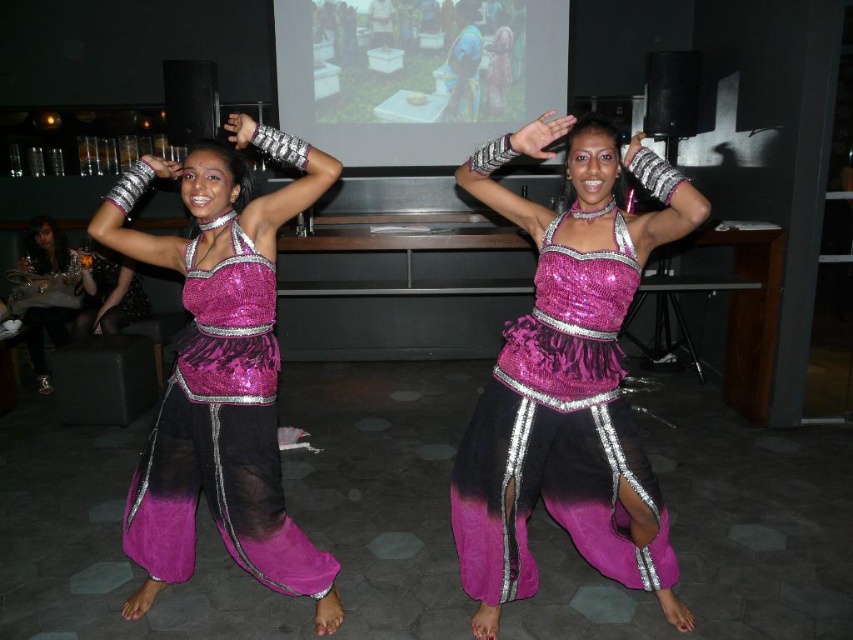
Is point (546, 317) positioned before point (207, 429)?

Yes.

Does shiny sequined dress at center have a greater width compared to fuchsia sequined dress at center?

In fact, shiny sequined dress at center might be narrower than fuchsia sequined dress at center.

Between point (505, 600) and point (190, 518), which one is positioned in front?

Point (505, 600) is more forward.

Locate an element on the screen. This screenshot has width=853, height=640. shiny sequined dress at center is located at coordinates (558, 435).

Who is shorter, shiny sequined dress at center or matte black dress at lower left?

With less height is matte black dress at lower left.

Is shiny sequined dress at center wider than matte black dress at lower left?

Correct, the width of shiny sequined dress at center exceeds that of matte black dress at lower left.

Is point (616, 298) less distant than point (33, 371)?

Yes, it is in front of point (33, 371).

Where is `shiny sequined dress at center`? The width and height of the screenshot is (853, 640). shiny sequined dress at center is located at coordinates (558, 435).

Is fuchsia sequined dress at center to the right of matte black dress at lower left from the viewer's perspective?

Correct, you'll find fuchsia sequined dress at center to the right of matte black dress at lower left.

Does fuchsia sequined dress at center appear over matte black dress at lower left?

Actually, fuchsia sequined dress at center is below matte black dress at lower left.

Is point (264, 468) positioned behind point (48, 298)?

No, it is not.

Find the location of `fuchsia sequined dress at center`. fuchsia sequined dress at center is located at coordinates (222, 438).